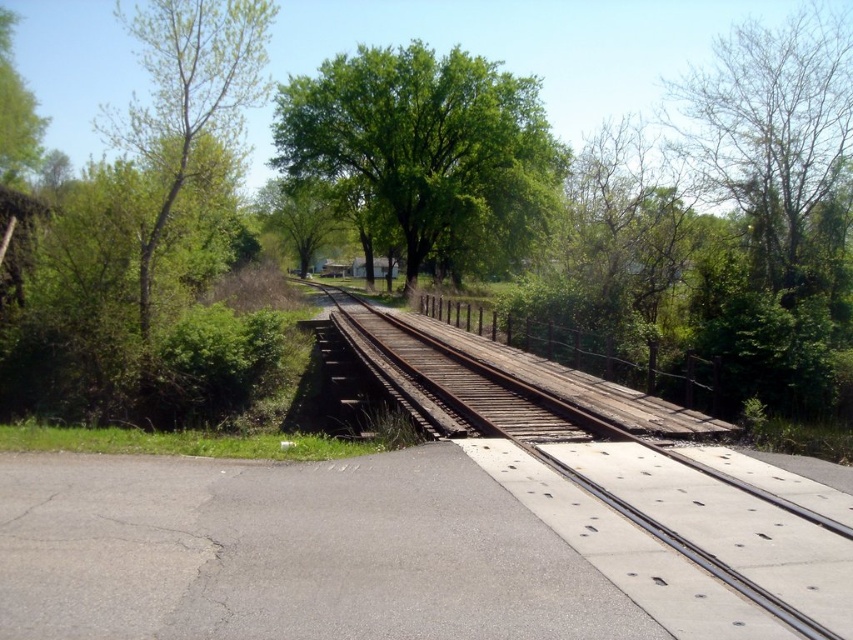
You are standing at the railway crossing and want to know which object is taller between the rusty metal train track at center and the green leafy tree at upper center. Can you determine which one is taller?

The green leafy tree at upper center is taller than the rusty metal train track at center.

You are standing at the railway crossing and notice the rusty metal train track at center and the bare wood tree at upper right. Which object appears taller in the image?

The bare wood tree at upper right is taller than the rusty metal train track at center according to the description.

You are a pedestrian standing on the road near the rusty metal train track at center. You want to walk to the green leafy tree at upper center. Which direction should you move to reach it?

The green leafy tree at upper center is above the rusty metal train track at center, so you should move upward from the rusty metal train track at center to reach the green leafy tree at upper center.